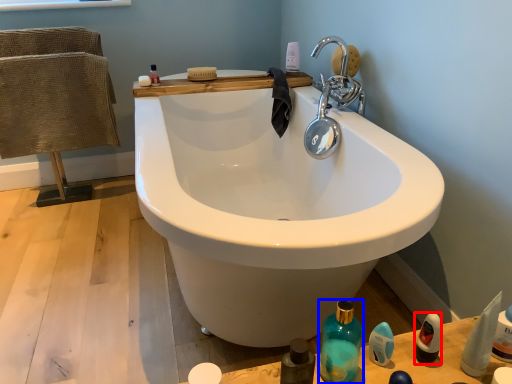
Question: Which object appears closest to the camera in this image, mouthwash (highlighted by a red box) or bottle (highlighted by a blue box)?

Choices:
 (A) mouthwash
 (B) bottle

Answer: (B)